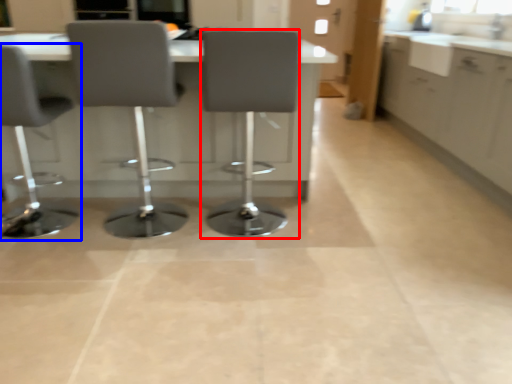
Question: Which of the following is the closest to the observer, chair (highlighted by a red box) or chair (highlighted by a blue box)?

Choices:
 (A) chair
 (B) chair

Answer: (B)